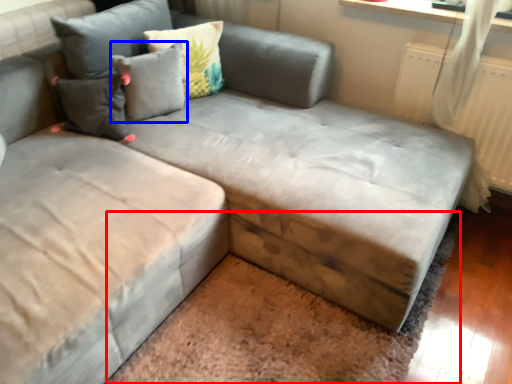
Question: Which object is further to the camera taking this photo, mat (highlighted by a red box) or pillow (highlighted by a blue box)?

Choices:
 (A) mat
 (B) pillow

Answer: (B)